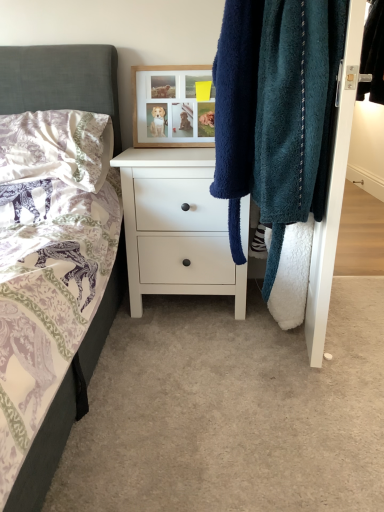
Image resolution: width=384 pixels, height=512 pixels. What are the coordinates of `vacant area on top of white matte chest of drawers at center (from a real-world perspective)` in the screenshot? It's located at (168, 151).